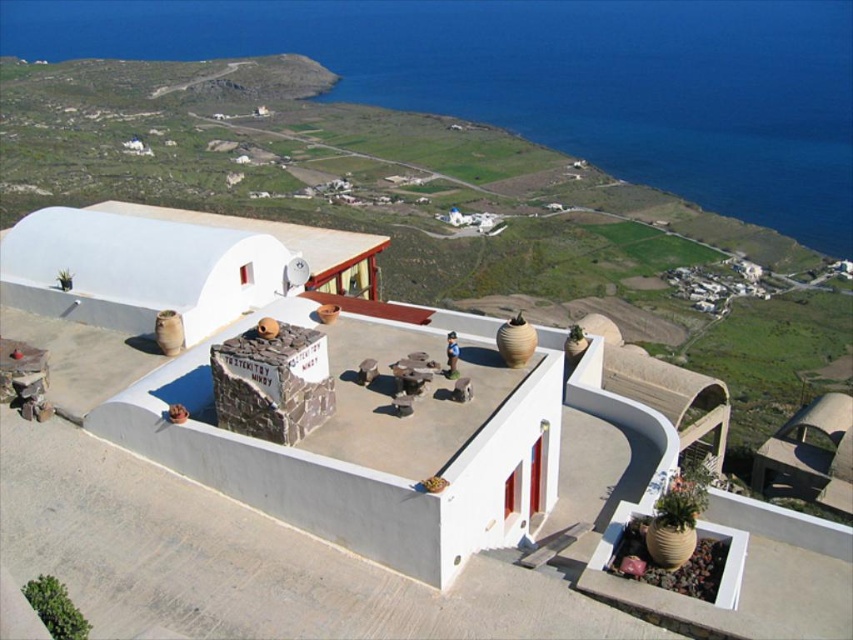
You are a landscape architect evaluating the view from the rooftop seating area of the building. Which of the two elements, the white stone hillside at upper center or the blue water at upper right, occupies a larger portion of the view?

The blue water at upper right occupies a larger portion of the view because it is bigger than the white stone hillside at upper center.

You are standing at the base of the hillside where the modern building is located. You see two points marked on the image, point 1 at coordinates point (511, 282) and point 2 at coordinates point (691, 3). If you want to reach point 2 first, which point should you approach first?

To reach point 2 at point (691, 3) first, you should approach point 1 at point (511, 282) first because it is in front of point 2.